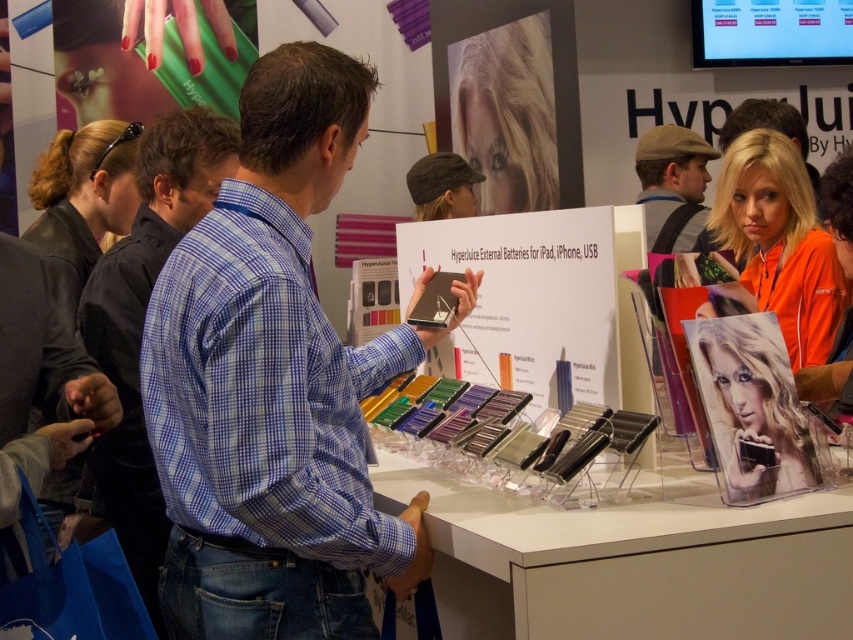
You are a photographer at the electronics show and want to capture a photo of the blue checkered shirt at center and the blonde hair at upper right. Which object should you focus on first if you want to prioritize the one that is closer to the camera?

The blonde hair at upper right is closer to the camera than the blue checkered shirt at center, so you should focus on the blonde hair at upper right first.

In the scene shown: You are a photographer at the electronics trade show. You need to take a photo of the blue checkered shirt at center and the blonde hair at center. Which object is positioned higher in the image?

The blue checkered shirt at center is above blonde hair at center, so the blue checkered shirt at center is positioned higher in the image.